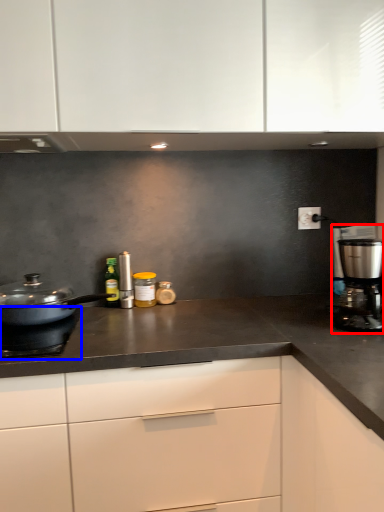
Question: Which object appears closest to the camera in this image, kitchen appliance (highlighted by a red box) or gas stove (highlighted by a blue box)?

Choices:
 (A) kitchen appliance
 (B) gas stove

Answer: (B)